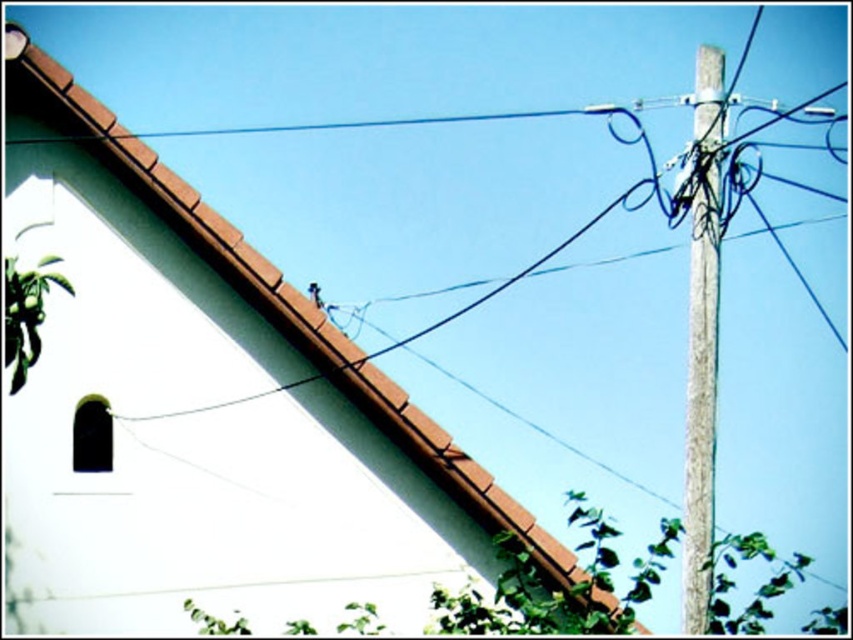
Question: Does brown tile roof at upper left appear over gray concrete pole at right?

Choices:
 (A) no
 (B) yes

Answer: (B)

Question: Which object appears farthest from the camera in this image?

Choices:
 (A) gray concrete pole at right
 (B) brown tile roof at upper left

Answer: (B)

Question: Where is brown tile roof at upper left located in relation to gray concrete pole at right in the image?

Choices:
 (A) above
 (B) below

Answer: (A)

Question: Considering the relative positions of brown tile roof at upper left and gray concrete pole at right in the image provided, where is brown tile roof at upper left located with respect to gray concrete pole at right?

Choices:
 (A) below
 (B) above

Answer: (B)